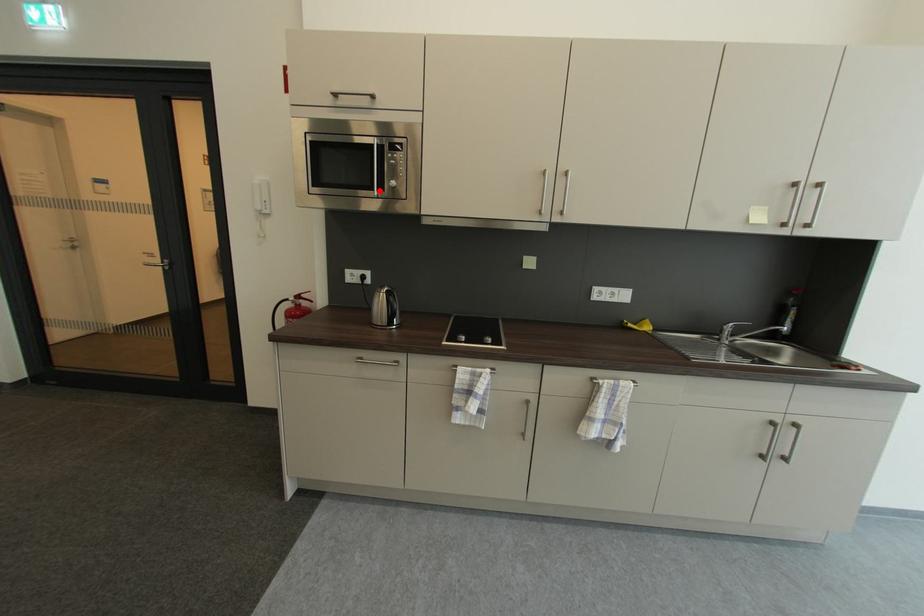
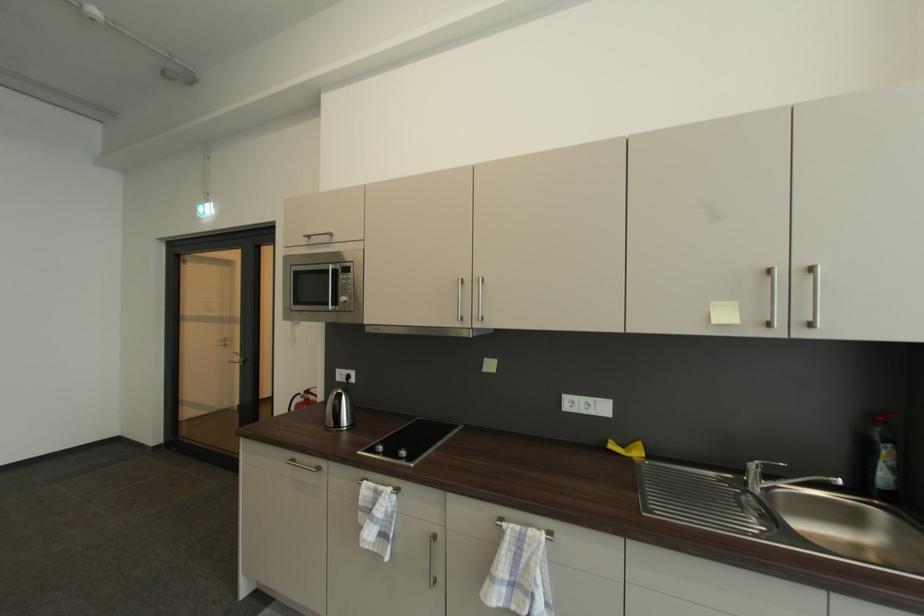
In the second image, find the point that corresponds to the highlighted location in the first image.

(334, 306)